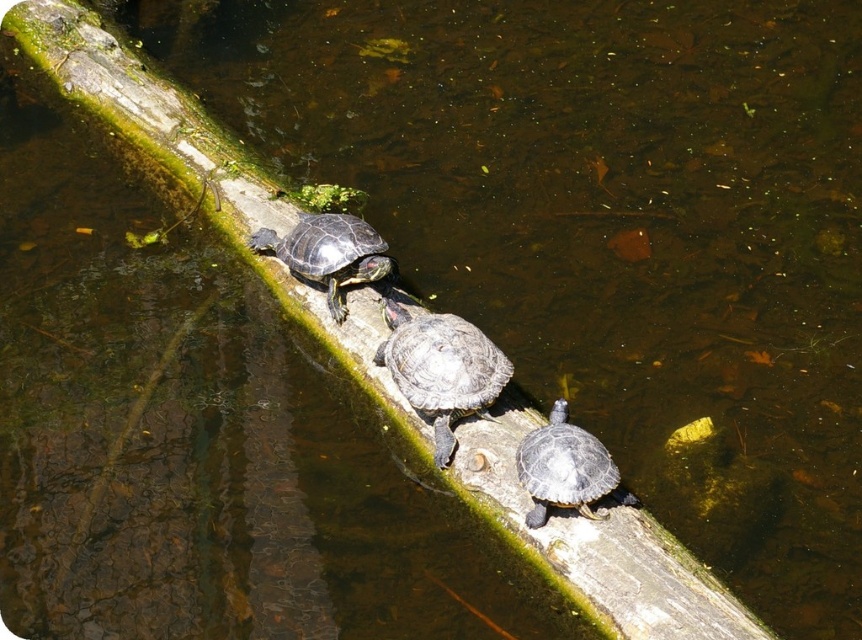
Describe the element at coordinates (441, 369) in the screenshot. The width and height of the screenshot is (862, 640). I see `smooth gray tortoise at center` at that location.

Is smooth gray tortoise at center shorter than shiny dark green tortoise at center?

Incorrect, smooth gray tortoise at center's height does not fall short of shiny dark green tortoise at center's.

Who is more distant from viewer, (435,458) or (572,467)?

The point (435,458) is more distant.

The height and width of the screenshot is (640, 862). What are the coordinates of `smooth gray tortoise at center` in the screenshot? It's located at (441, 369).

How far apart are smooth gray tortoise at center and shiny dark green tortoise at upper center?

A distance of 41.42 centimeters exists between smooth gray tortoise at center and shiny dark green tortoise at upper center.

Is smooth gray tortoise at center thinner than shiny dark green tortoise at upper center?

Yes, smooth gray tortoise at center is thinner than shiny dark green tortoise at upper center.

Describe the element at coordinates (441, 369) in the screenshot. I see `smooth gray tortoise at center` at that location.

At what (x,y) coordinates should I click in order to perform the action: click on smooth gray tortoise at center. Please return your answer as a coordinate pair (x, y). Image resolution: width=862 pixels, height=640 pixels. Looking at the image, I should click on (441, 369).

Does shiny dark green tortoise at center lie in front of shiny dark green tortoise at upper center?

Yes.

Can you confirm if shiny dark green tortoise at center is bigger than shiny dark green tortoise at upper center?

No, shiny dark green tortoise at center is not bigger than shiny dark green tortoise at upper center.

Is point (579, 468) closer to camera compared to point (297, 273)?

Yes, point (579, 468) is closer to viewer.

Where is `shiny dark green tortoise at center`? This screenshot has height=640, width=862. shiny dark green tortoise at center is located at coordinates (566, 468).